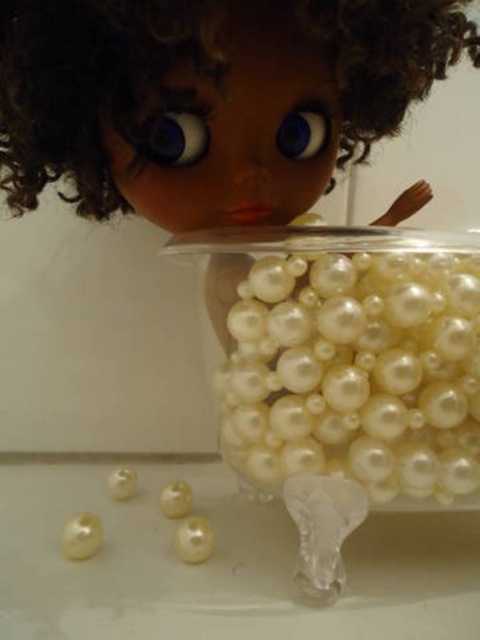
Question: Is pearl/glass at lower left wider than pearl-like plastic at lower center?

Choices:
 (A) no
 (B) yes

Answer: (A)

Question: Among these points, which one is farthest from the camera?

Choices:
 (A) (123, 496)
 (B) (17, 54)

Answer: (A)

Question: Is blue glossy eye at upper center above blue glossy eye at center?

Choices:
 (A) yes
 (B) no

Answer: (B)

Question: Which point is farther to the camera?

Choices:
 (A) (203, 150)
 (B) (132, 496)
 (C) (264, 248)

Answer: (B)

Question: Does pearl/glass at lower left have a smaller size compared to pearl-like at lower left?

Choices:
 (A) yes
 (B) no

Answer: (A)

Question: Which point is closer to the camera?

Choices:
 (A) (132, 493)
 (B) (95, 536)
 (C) (11, 0)
 (D) (208, 134)

Answer: (C)